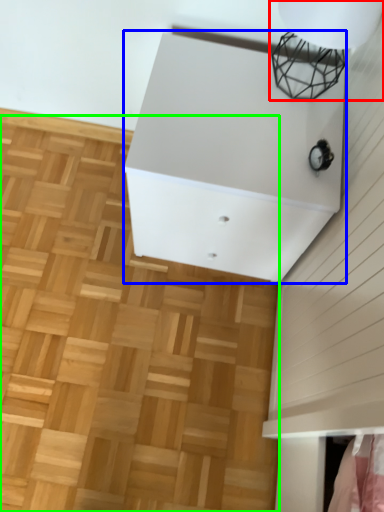
Question: Which object is the farthest from lamp (highlighted by a red box)? Choose among these: furniture (highlighted by a blue box) or hardwood (highlighted by a green box).

Choices:
 (A) furniture
 (B) hardwood

Answer: (B)